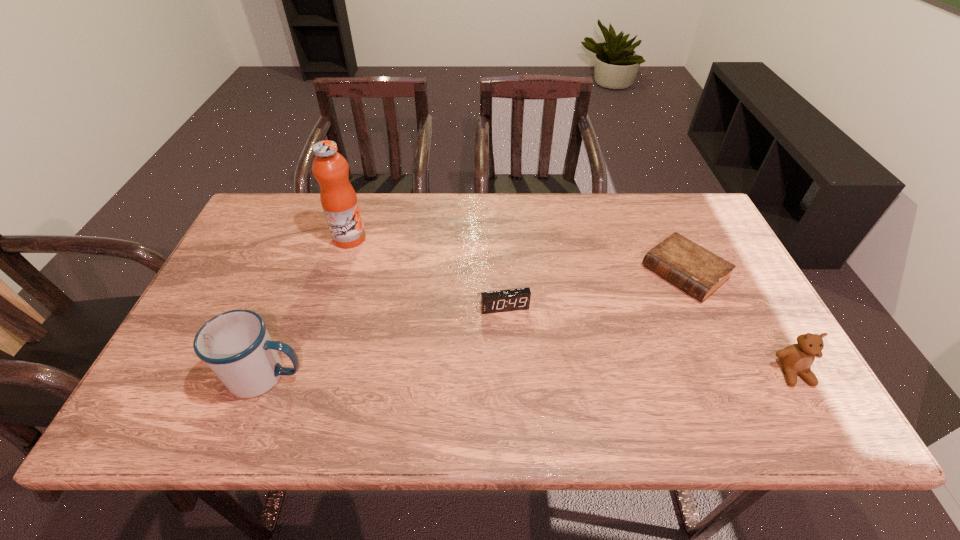
You are a GUI agent. You are given a task and a screenshot of the screen. Output one action in this format:
    pyautogui.click(x=<x>, y=<y>)
    Task: Click on the teddy bear located at the right edge
    This screenshot has width=960, height=540.
    Given the screenshot: What is the action you would take?
    pyautogui.click(x=797, y=358)

Where is `diary that is at the right edge`? diary that is at the right edge is located at coordinates (699, 272).

Image resolution: width=960 pixels, height=540 pixels. What are the coordinates of `object situated at the near left corner` in the screenshot? It's located at (235, 345).

Where is `object present at the near right corner`? The height and width of the screenshot is (540, 960). object present at the near right corner is located at coordinates (797, 358).

The image size is (960, 540). I want to click on vacant space at the far edge of the desktop, so click(x=539, y=220).

This screenshot has height=540, width=960. In the image, there is a desktop. In order to click on free space at the left edge in this screenshot , I will do `click(245, 289)`.

This screenshot has height=540, width=960. In order to click on vacant space at the right edge of the desktop in this screenshot , I will do click(x=714, y=302).

Locate an element on the screen. The width and height of the screenshot is (960, 540). blank space at the far left corner of the desktop is located at coordinates (278, 235).

The image size is (960, 540). What are the coordinates of `vacant region at the near left corner of the desktop` in the screenshot? It's located at (169, 375).

This screenshot has width=960, height=540. In the image, there is a desktop. In order to click on free space at the far right corner in this screenshot , I will do `click(672, 201)`.